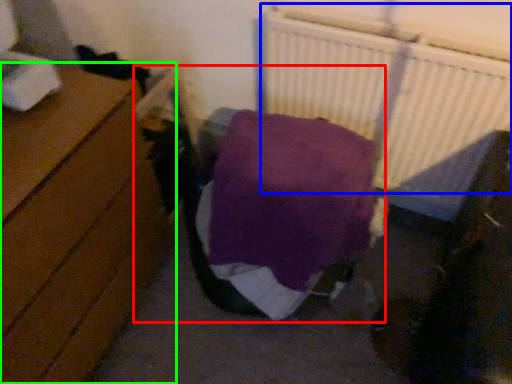
Question: Which object is positioned farthest from bed (highlighted by a red box)? Select from radiator (highlighted by a blue box) and furniture (highlighted by a green box).

Choices:
 (A) radiator
 (B) furniture

Answer: (A)